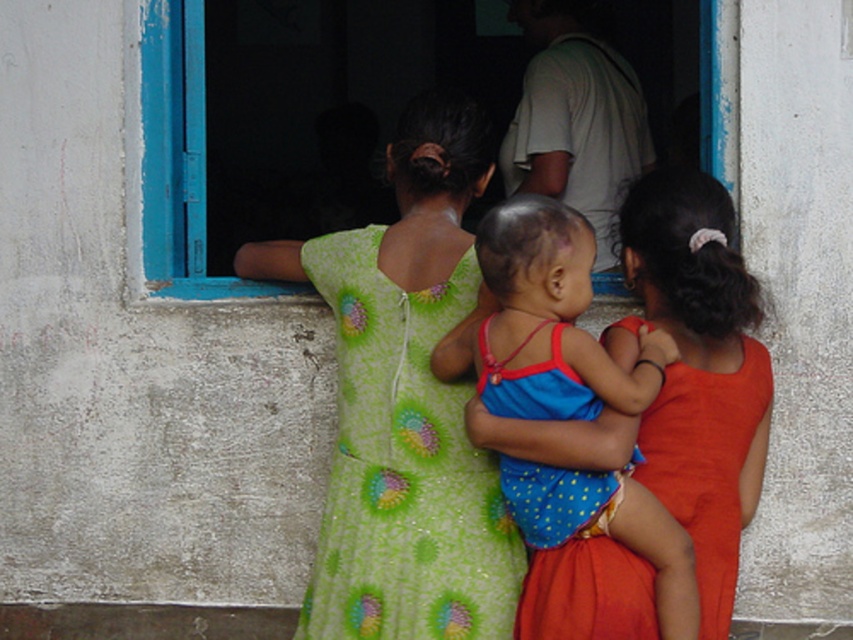
Locate an element on the screen. blue polka dot fabric at center is located at coordinates (550, 321).

Does blue polka dot fabric at center appear on the right side of blue painted wood at upper left?

Correct, you'll find blue polka dot fabric at center to the right of blue painted wood at upper left.

Find the location of a particular element. blue polka dot fabric at center is located at coordinates (550, 321).

Does blue polka dot fabric at center have a larger size compared to orange satin dress at center?

No, blue polka dot fabric at center is not bigger than orange satin dress at center.

Does point (595, 529) come behind point (521, 605)?

That is False.

Where is `blue polka dot fabric at center`? blue polka dot fabric at center is located at coordinates (550, 321).

Where is `blue polka dot fabric at center`? This screenshot has height=640, width=853. blue polka dot fabric at center is located at coordinates click(550, 321).

Is point (366, 508) positioned after point (486, 259)?

Yes.

What are the coordinates of `green printed fabric dress at center` in the screenshot? It's located at (404, 467).

Image resolution: width=853 pixels, height=640 pixels. In order to click on green printed fabric dress at center in this screenshot , I will do [x=404, y=467].